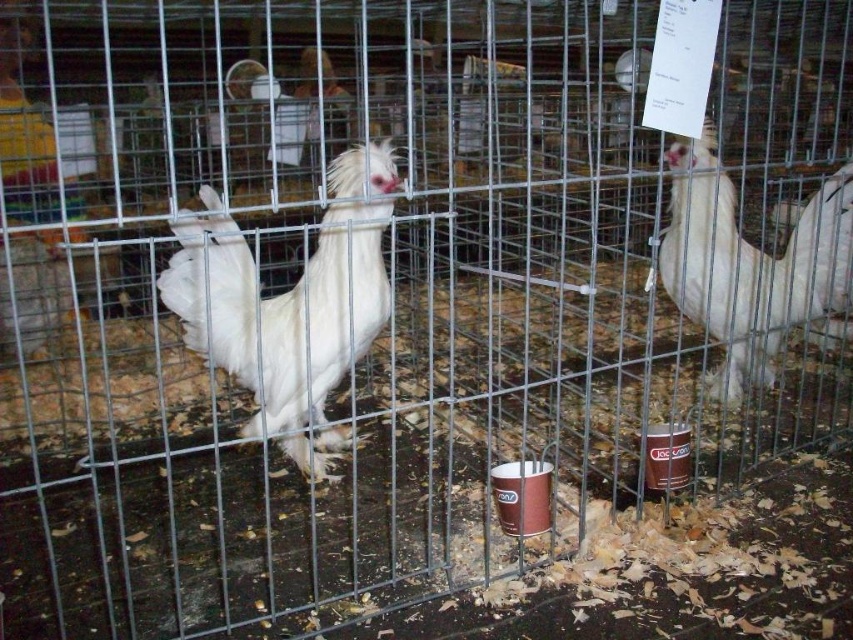
Question: Which of the following is the closest to the observer?

Choices:
 (A) (842, 204)
 (B) (231, 225)

Answer: (B)

Question: Can you confirm if white feathered rooster at center is smaller than white fluffy chicken at right?

Choices:
 (A) yes
 (B) no

Answer: (A)

Question: Is white feathered rooster at center above white fluffy chicken at right?

Choices:
 (A) no
 (B) yes

Answer: (A)

Question: Can you confirm if white feathered rooster at center is wider than white fluffy chicken at right?

Choices:
 (A) no
 (B) yes

Answer: (A)